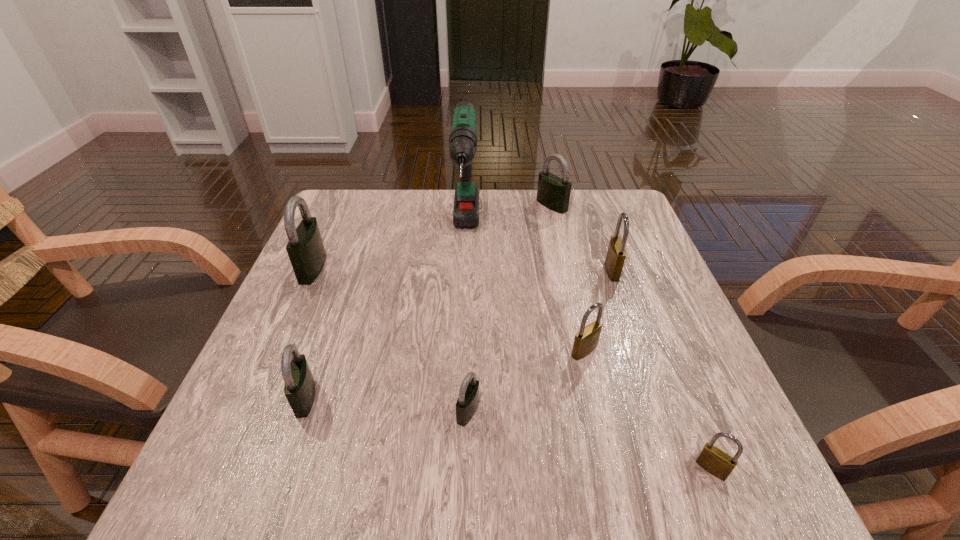
The height and width of the screenshot is (540, 960). What are the coordinates of `blank space located 0.110m on the back of the second smallest black padlock` in the screenshot? It's located at (328, 332).

Find the location of a particular element. Image resolution: width=960 pixels, height=540 pixels. free region located on the front of the fourth nearest object is located at coordinates (619, 503).

Locate an element on the screen. The width and height of the screenshot is (960, 540). vacant point located 0.060m on the front of the third padlock from left to right is located at coordinates (468, 463).

Locate an element on the screen. The width and height of the screenshot is (960, 540). vacant space located on the left of the rightmost object is located at coordinates (651, 469).

Where is `drill that is at the far edge`? drill that is at the far edge is located at coordinates 463,140.

Find the location of `padlock situated at the far edge`. padlock situated at the far edge is located at coordinates (553, 192).

Where is `object at the near edge`? object at the near edge is located at coordinates (716, 462).

The width and height of the screenshot is (960, 540). Find the location of `object that is at the near right corner`. object that is at the near right corner is located at coordinates (716, 462).

Where is `free spot at the far edge of the desktop`? This screenshot has height=540, width=960. free spot at the far edge of the desktop is located at coordinates (400, 225).

Locate an element on the screen. The image size is (960, 540). vacant space at the near edge of the desktop is located at coordinates (430, 456).